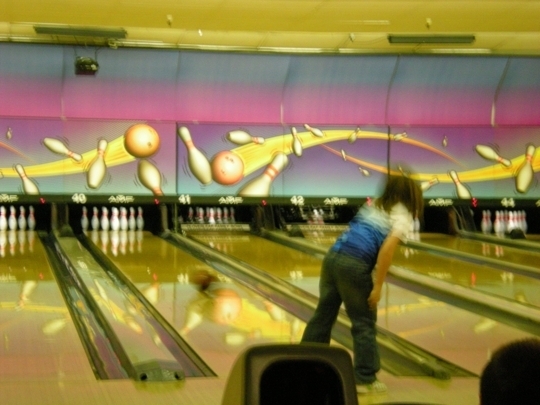
Where is `top panels of wall above lanes`? The height and width of the screenshot is (405, 540). top panels of wall above lanes is located at coordinates (20, 75), (125, 87), (216, 83), (328, 83), (461, 92), (530, 96).